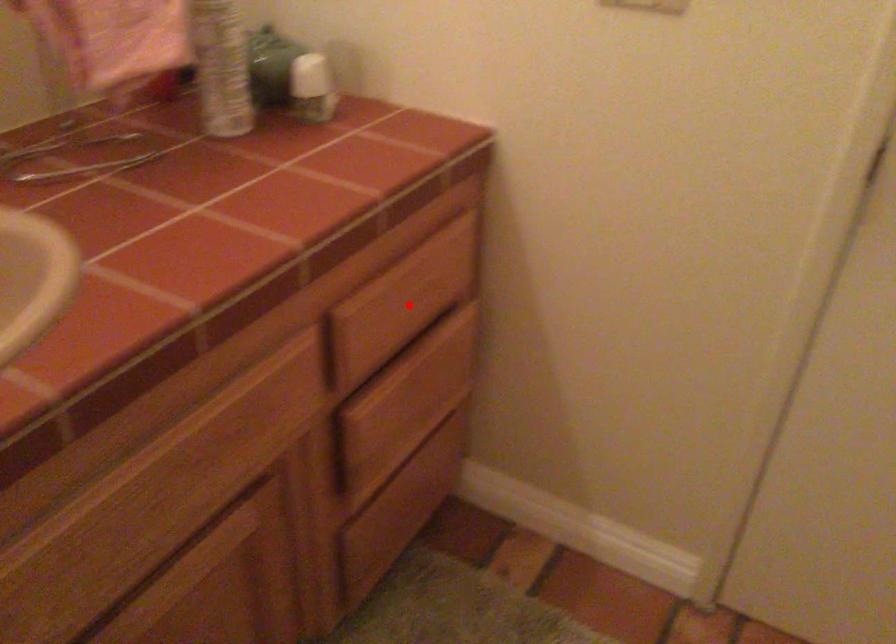
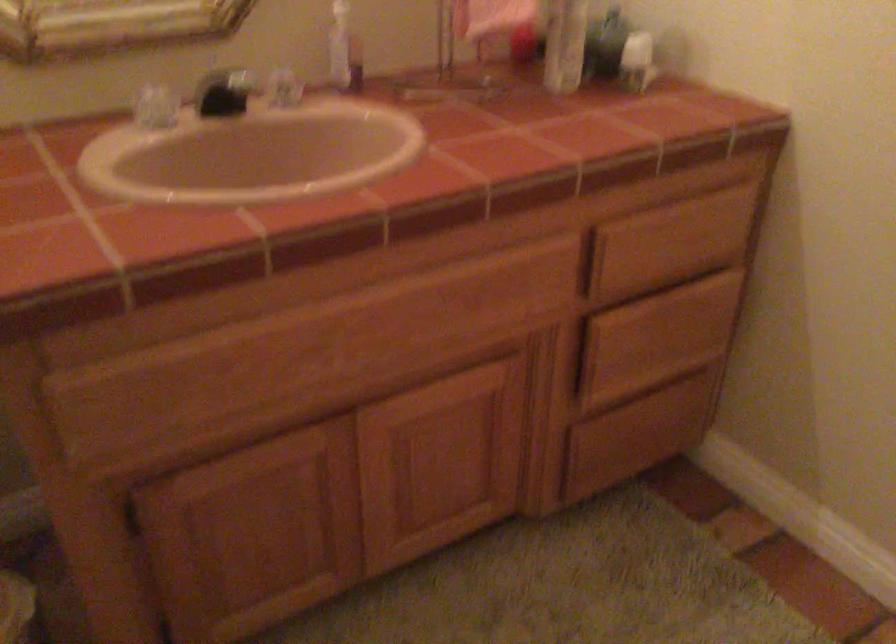
Question: A red point is marked in image1. In image2, is the corresponding 3D point closer to the camera or farther? Reply with the corresponding letter.

Choices:
 (A) The corresponding 3D point is closer.
 (B) The corresponding 3D point is farther.

Answer: (B)